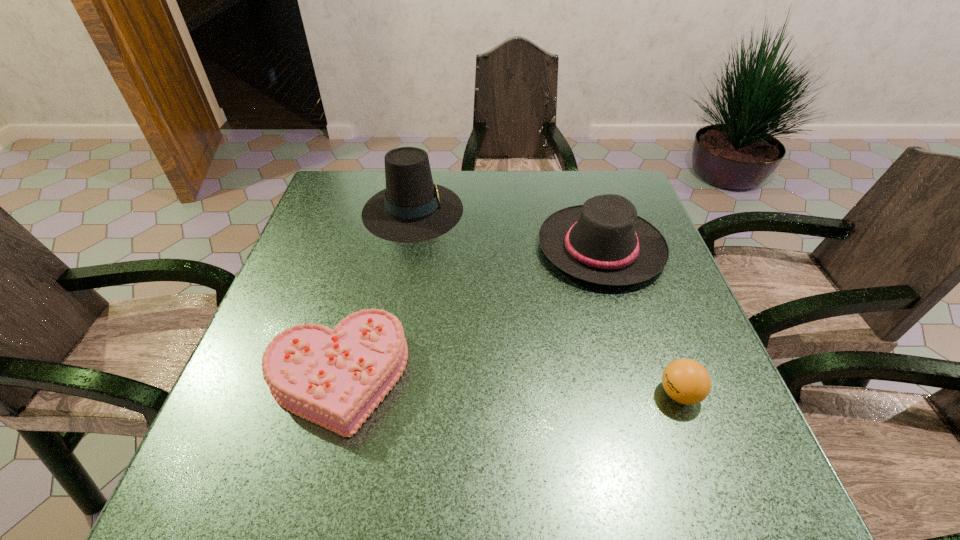
The width and height of the screenshot is (960, 540). I want to click on the left dress hat, so click(x=411, y=209).

The width and height of the screenshot is (960, 540). What are the coordinates of `the tallest object` in the screenshot? It's located at (411, 209).

You are a GUI agent. You are given a task and a screenshot of the screen. Output one action in this format:
    pyautogui.click(x=<x>, y=<y>)
    Task: Click on the right dress hat
    This screenshot has height=540, width=960.
    Given the screenshot: What is the action you would take?
    pyautogui.click(x=604, y=241)

Identify the location of the second tallest object. The image size is (960, 540). (604, 241).

The width and height of the screenshot is (960, 540). What are the coordinates of `ping-pong ball` in the screenshot? It's located at (686, 381).

In order to click on cake in this screenshot , I will do `click(335, 378)`.

Find the location of a particular element. The height and width of the screenshot is (540, 960). vacant space positioned 0.200m on the front-facing side of the taller dress hat is located at coordinates (535, 210).

Identify the location of free spot located 0.200m on the front of the third shortest object. The height and width of the screenshot is (540, 960). (636, 367).

Locate an element on the screen. vacant space located on the side with brand of the ping-pong ball is located at coordinates (513, 394).

At what (x,y) coordinates should I click in order to perform the action: click on vacant position located on the side with brand of the ping-pong ball. Please return your answer as a coordinate pair (x, y). The height and width of the screenshot is (540, 960). Looking at the image, I should click on (513, 394).